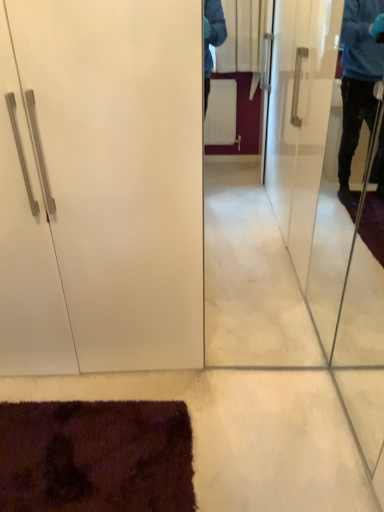
You are a GUI agent. You are given a task and a screenshot of the screen. Output one action in this format:
    pyautogui.click(x=<x>, y=<y>)
    Task: Click on the transparent glass screen door at right
    
    Given the screenshot: What is the action you would take?
    pyautogui.click(x=350, y=203)

What do you see at coordinates (350, 203) in the screenshot? The height and width of the screenshot is (512, 384). I see `transparent glass screen door at right` at bounding box center [350, 203].

Where is `white glossy cabinet at left`? The height and width of the screenshot is (512, 384). white glossy cabinet at left is located at coordinates (101, 186).

What do you see at coordinates (101, 186) in the screenshot? I see `white glossy cabinet at left` at bounding box center [101, 186].

Where is `transparent glass screen door at right`? transparent glass screen door at right is located at coordinates (350, 203).

Considering the relative positions of transparent glass screen door at right and white glossy cabinet at left in the image provided, is transparent glass screen door at right to the right of white glossy cabinet at left from the viewer's perspective?

Correct, you'll find transparent glass screen door at right to the right of white glossy cabinet at left.

Which is in front, transparent glass screen door at right or white glossy cabinet at left?

transparent glass screen door at right is in front.

Which is in front, point (321, 217) or point (48, 93)?

The point (48, 93) is closer to the camera.

From the image's perspective, is transparent glass screen door at right over white glossy cabinet at left?

No.

From a real-world perspective, which is physically above, transparent glass screen door at right or white glossy cabinet at left?

white glossy cabinet at left, from a real-world perspective.

Considering the relative sizes of transparent glass screen door at right and white glossy cabinet at left in the image provided, is transparent glass screen door at right wider than white glossy cabinet at left?

No, transparent glass screen door at right is not wider than white glossy cabinet at left.

Considering the relative sizes of transparent glass screen door at right and white glossy cabinet at left in the image provided, is transparent glass screen door at right taller than white glossy cabinet at left?

No.

Does transparent glass screen door at right have a larger size compared to white glossy cabinet at left?

Incorrect, transparent glass screen door at right is not larger than white glossy cabinet at left.

Do you think transparent glass screen door at right is within white glossy cabinet at left, or outside of it?

transparent glass screen door at right is located beyond the bounds of white glossy cabinet at left.

Are transparent glass screen door at right and white glossy cabinet at left located far from each other?

Yes.

Is white glossy cabinet at left at the back of transparent glass screen door at right?

No, transparent glass screen door at right is not facing the opposite direction of white glossy cabinet at left.

How different are the orientations of transparent glass screen door at right and white glossy cabinet at left in degrees?

The angle between the facing direction of transparent glass screen door at right and the facing direction of white glossy cabinet at left is 92.1 degrees.

Find the location of `door located behind the transparent glass screen door at right`. door located behind the transparent glass screen door at right is located at coordinates (101, 186).

Considering the relative positions of white glossy cabinet at left and transparent glass screen door at right in the image provided, is white glossy cabinet at left to the right of transparent glass screen door at right from the viewer's perspective?

In fact, white glossy cabinet at left is to the left of transparent glass screen door at right.

In the image, is white glossy cabinet at left positioned in front of or behind transparent glass screen door at right?

Visually, white glossy cabinet at left is located behind transparent glass screen door at right.

Which is nearer, (37, 165) or (322, 234)?

Point (37, 165).

Looking at this image, from the image's perspective, between white glossy cabinet at left and transparent glass screen door at right, which one is located above?

white glossy cabinet at left.

From a real-world perspective, is white glossy cabinet at left physically below transparent glass screen door at right?

No, from a real-world perspective, white glossy cabinet at left is not below transparent glass screen door at right.

Looking at their sizes, would you say white glossy cabinet at left is wider or thinner than transparent glass screen door at right?

Considering their sizes, white glossy cabinet at left looks broader than transparent glass screen door at right.

Based on the photo, in terms of height, does white glossy cabinet at left look taller or shorter compared to transparent glass screen door at right?

Considering their sizes, white glossy cabinet at left has more height than transparent glass screen door at right.

Does white glossy cabinet at left have a larger size compared to transparent glass screen door at right?

Yes.

Would you say white glossy cabinet at left is inside or outside transparent glass screen door at right?

white glossy cabinet at left is outside transparent glass screen door at right.

Would you say white glossy cabinet at left is a long distance from transparent glass screen door at right?

Indeed, white glossy cabinet at left is not near transparent glass screen door at right.

Is white glossy cabinet at left aimed at transparent glass screen door at right?

No, white glossy cabinet at left is not facing towards transparent glass screen door at right.

Based on the photo, what's the angular difference between white glossy cabinet at left and transparent glass screen door at right's facing directions?

The angle between the facing direction of white glossy cabinet at left and the facing direction of transparent glass screen door at right is 92.1 degrees.

Identify the location of door on the left side of transparent glass screen door at right. The image size is (384, 512). (101, 186).

What are the coordinates of `door above the transparent glass screen door at right (from the image's perspective)` in the screenshot? It's located at (101, 186).

At what (x,y) coordinates should I click in order to perform the action: click on screen door in front of the white glossy cabinet at left. Please return your answer as a coordinate pair (x, y). This screenshot has width=384, height=512. Looking at the image, I should click on (350, 203).